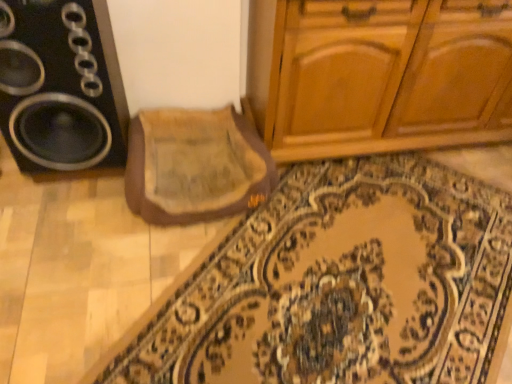
You are a GUI agent. You are given a task and a screenshot of the screen. Output one action in this format:
    pyautogui.click(x=<x>, y=<y>)
    Task: Click on the beige fabric mat at center
    Image resolution: width=512 pixels, height=384 pixels.
    Given the screenshot: What is the action you would take?
    pyautogui.click(x=195, y=166)

Can you confirm if carpeted mat at center is thinner than beige fabric mat at center?

No, carpeted mat at center is not thinner than beige fabric mat at center.

From the image's perspective, between carpeted mat at center and beige fabric mat at center, who is located below?

carpeted mat at center appears lower in the image.

Is carpeted mat at center bigger or smaller than beige fabric mat at center?

Considering their sizes, carpeted mat at center takes up more space than beige fabric mat at center.

Considering the relative sizes of beige fabric mat at center and black plastic speaker at left in the image provided, is beige fabric mat at center shorter than black plastic speaker at left?

Correct, beige fabric mat at center is not as tall as black plastic speaker at left.

Which object is further away from the camera taking this photo, beige fabric mat at center or black plastic speaker at left?

beige fabric mat at center is further from the camera.

The height and width of the screenshot is (384, 512). Identify the location of speaker on the left of beige fabric mat at center. (61, 86).

Is beige fabric mat at center positioned beyond the bounds of black plastic speaker at left?

Indeed, beige fabric mat at center is completely outside black plastic speaker at left.

How different are the orientations of carpeted mat at center and black plastic speaker at left in degrees?

They differ by 45.8 degrees in their facing directions.

From the image's perspective, is carpeted mat at center positioned above or below black plastic speaker at left?

Based on their image positions, carpeted mat at center is located beneath black plastic speaker at left.

Is point (284, 209) closer to viewer compared to point (124, 118)?

Yes, it is in front of point (124, 118).

From a real-world perspective, between carpeted mat at center and black plastic speaker at left, who is vertically higher?

black plastic speaker at left.

Can you confirm if beige fabric mat at center is smaller than carpeted mat at center?

Indeed, beige fabric mat at center has a smaller size compared to carpeted mat at center.

Considering the sizes of objects beige fabric mat at center and carpeted mat at center in the image provided, who is wider, beige fabric mat at center or carpeted mat at center?

With larger width is carpeted mat at center.

How far apart are beige fabric mat at center and carpeted mat at center?

15.71 inches.

Consider the image. Is beige fabric mat at center further to the viewer compared to carpeted mat at center?

Yes, beige fabric mat at center is further from the viewer.

Is black plastic speaker at left facing away from beige fabric mat at center?

No, beige fabric mat at center is not at the back of black plastic speaker at left.

Is black plastic speaker at left to the left of beige fabric mat at center from the viewer's perspective?

Yes.

Between black plastic speaker at left and beige fabric mat at center, which one is positioned in front?

black plastic speaker at left is in front.

Is black plastic speaker at left looking in the opposite direction of carpeted mat at center?

No.

From the image's perspective, which one is positioned lower, black plastic speaker at left or carpeted mat at center?

carpeted mat at center.

Locate an element on the screen. This screenshot has width=512, height=384. doormat on the right of black plastic speaker at left is located at coordinates (339, 285).

From a real-world perspective, is black plastic speaker at left on top of carpeted mat at center?

Correct, in the physical world, black plastic speaker at left is higher than carpeted mat at center.

Find the location of `doormat in front of the beige fabric mat at center`. doormat in front of the beige fabric mat at center is located at coordinates (339, 285).

Identify the location of mat that is below the black plastic speaker at left (from the image's perspective). (195, 166).

When comparing their distances from black plastic speaker at left, does beige fabric mat at center or carpeted mat at center seem closer?

beige fabric mat at center is closer to black plastic speaker at left.

Which object lies nearer to the anchor point carpeted mat at center, beige fabric mat at center or black plastic speaker at left?

beige fabric mat at center is positioned closer to the anchor carpeted mat at center.

Considering their positions, is black plastic speaker at left positioned closer to carpeted mat at center than beige fabric mat at center?

beige fabric mat at center is closer to carpeted mat at center.

Looking at the image, which one is located closer to black plastic speaker at left, carpeted mat at center or beige fabric mat at center?

beige fabric mat at center is closer to black plastic speaker at left.

When comparing their distances from beige fabric mat at center, does carpeted mat at center or black plastic speaker at left seem further?

carpeted mat at center.

Looking at this image, when comparing their distances from beige fabric mat at center, does black plastic speaker at left or carpeted mat at center seem closer?

black plastic speaker at left is positioned closer to the anchor beige fabric mat at center.

At what (x,y) coordinates should I click in order to perform the action: click on mat situated between black plastic speaker at left and carpeted mat at center from left to right. Please return your answer as a coordinate pair (x, y). The width and height of the screenshot is (512, 384). Looking at the image, I should click on (195, 166).